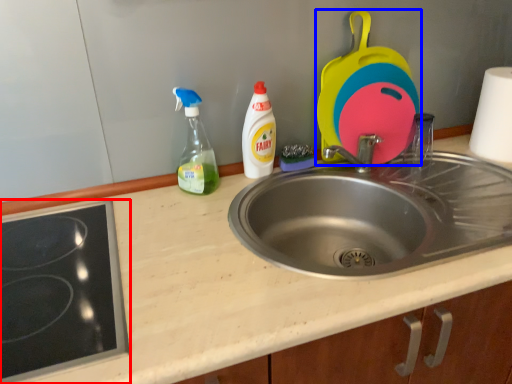
Question: Among these objects, which one is farthest to the camera, gas stove (highlighted by a red box) or appliance (highlighted by a blue box)?

Choices:
 (A) gas stove
 (B) appliance

Answer: (B)